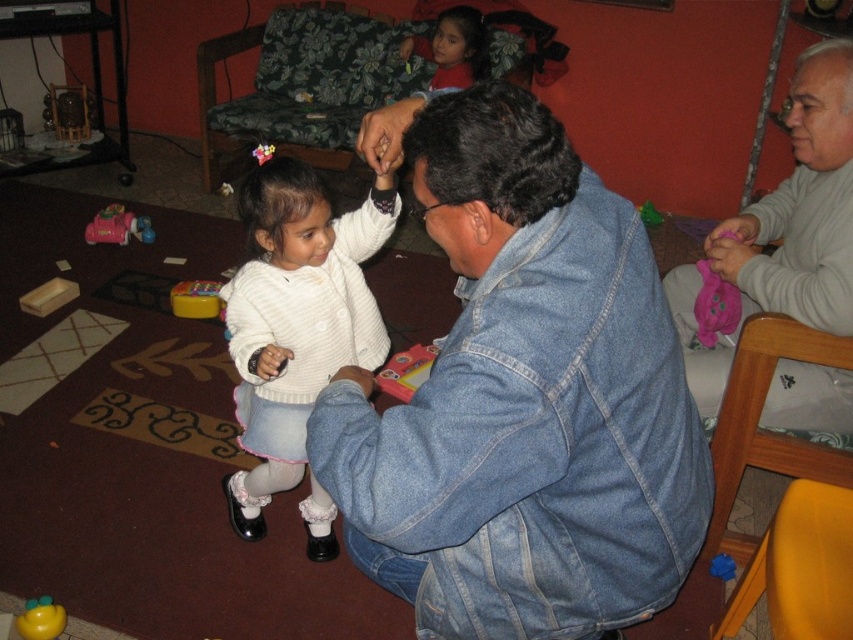
Based on the photo, in the scene, there is a white sweater at center and a pink plush toy at lower right. Which object is positioned to the right side?

The pink plush toy at lower right is positioned to the right of the white sweater at center.

Where is the matte plastic toy at center located in the image?

The matte plastic toy at center is located at the point with coordinates 0.580 on the x axis and 0.477 on the y axis.